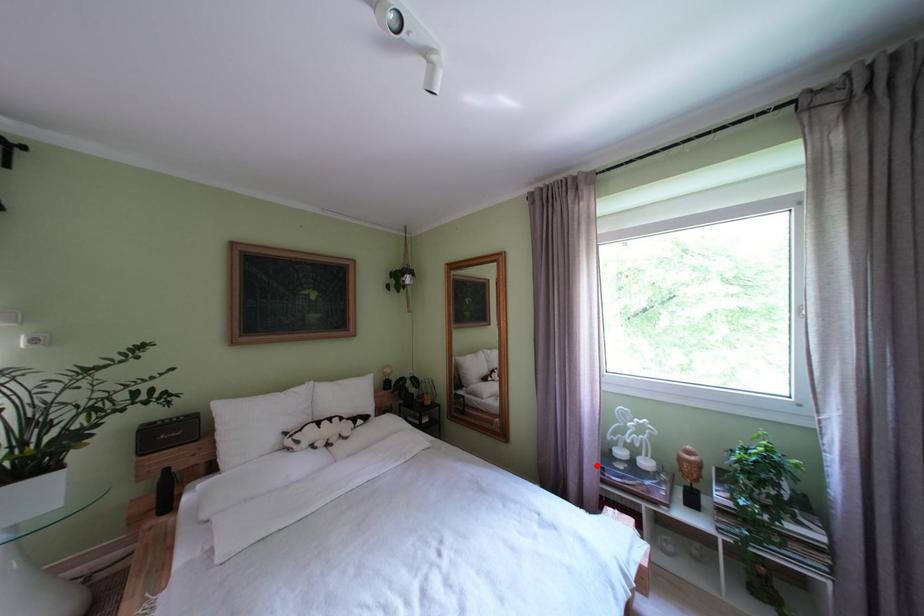
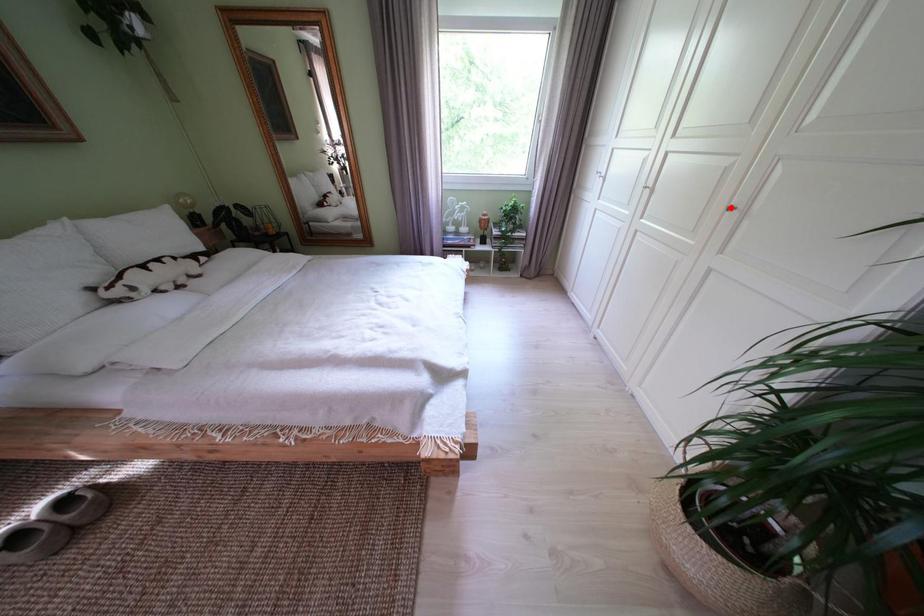
I am providing you with two images of the same scene from different viewpoints. A red point is marked on the first image and another point is marked on the second image. Is the marked point in image1 the same physical position as the marked point in image2?

No